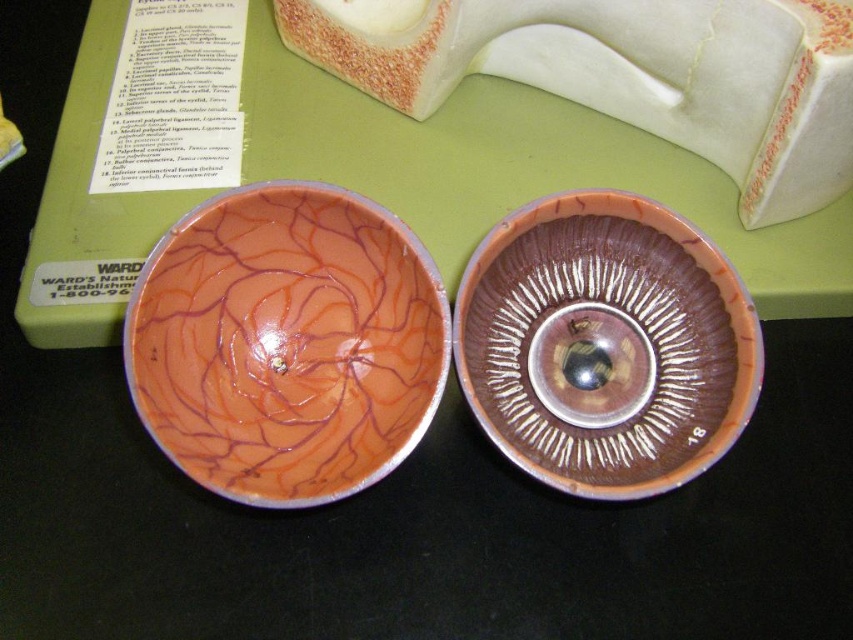
You are setting up a display for an art exhibition and have two bowls in front of you. The matte orange bowl at center and the shiny brown bowl at center. Which bowl should you choose if you want to use the one that is more slender?

The matte orange bowl at center is thinner than the shiny brown bowl at center, so you should choose the matte orange bowl at center for a more slender option.

You are a chef preparing a dessert display and have two bowls in front of you. You need to place a large fruit salad in the larger bowl. Which bowl should you choose between the matte orange bowl at center and the shiny brown bowl at center?

The shiny brown bowl at center is larger, so you should choose the shiny brown bowl at center to place the large fruit salad.